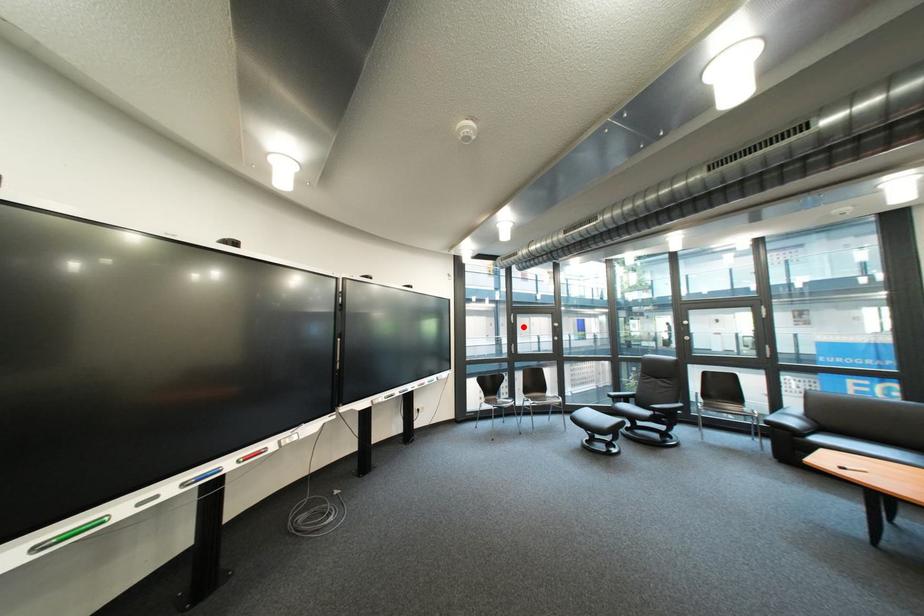
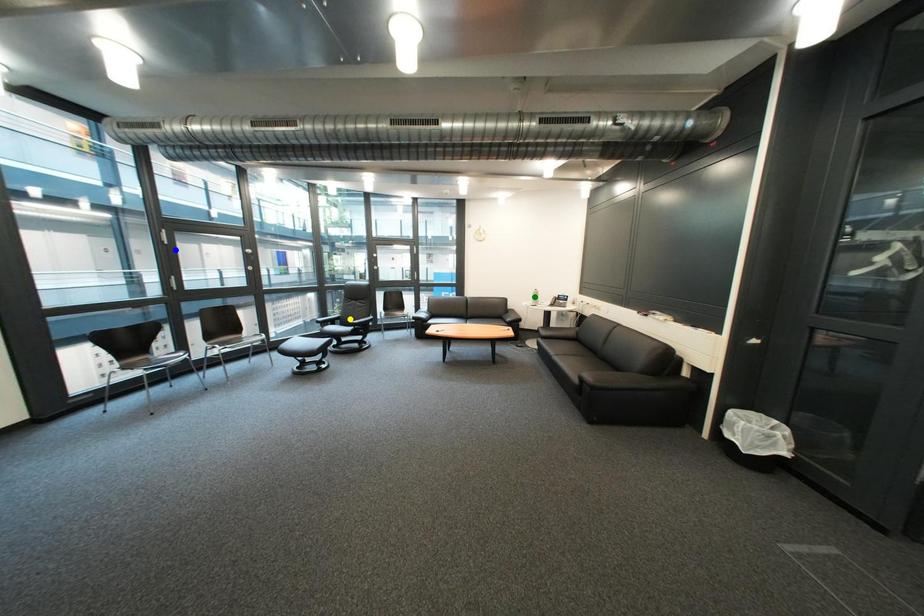
Question: I am providing you with two images of the same scene from different viewpoints. A red point is marked on the first image. You are given multiple points on the second image. Can you choose the point in image 2 that corresponds to the point in image 1?

Choices:
 (A) yellow point
 (B) green point
 (C) blue point

Answer: (C)